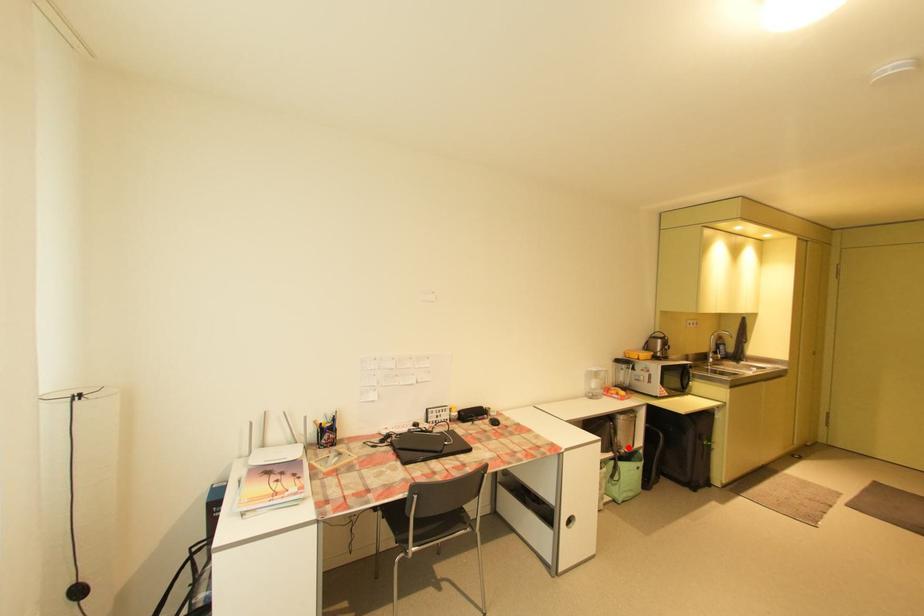
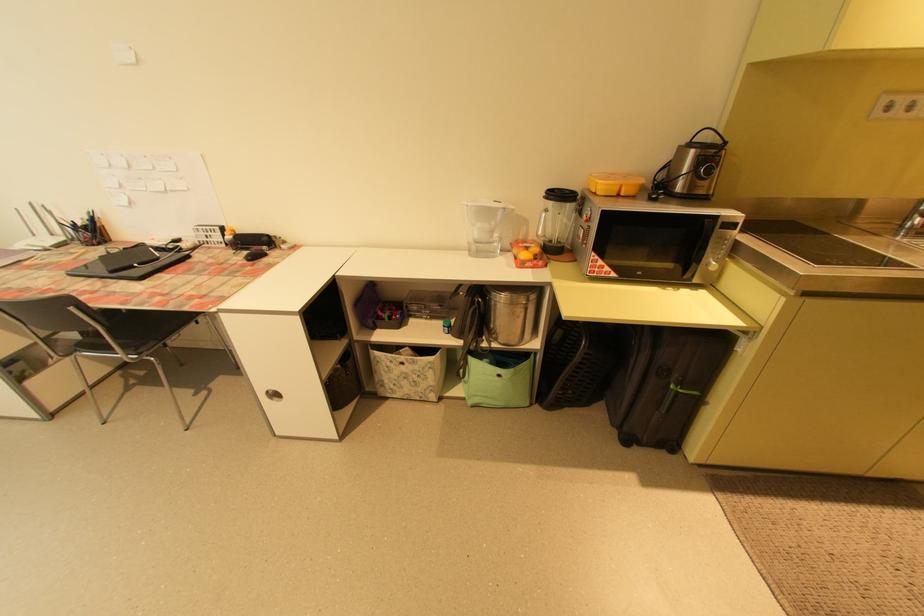
Question: I am providing you with two images of the same scene from different viewpoints. In image1, a red point is highlighted. Considering the same 3D point in image2, which of the following is correct?

Choices:
 (A) It is closer
 (B) It is farther

Answer: (A)